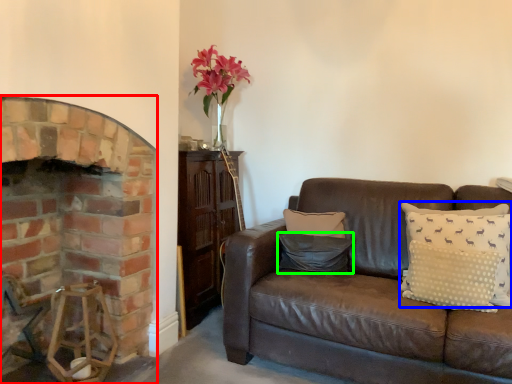
Question: Estimate the real-world distances between objects in this image. Which object is closer to fireplace (highlighted by a red box), pillow (highlighted by a blue box) or pillow (highlighted by a green box)?

Choices:
 (A) pillow
 (B) pillow

Answer: (B)